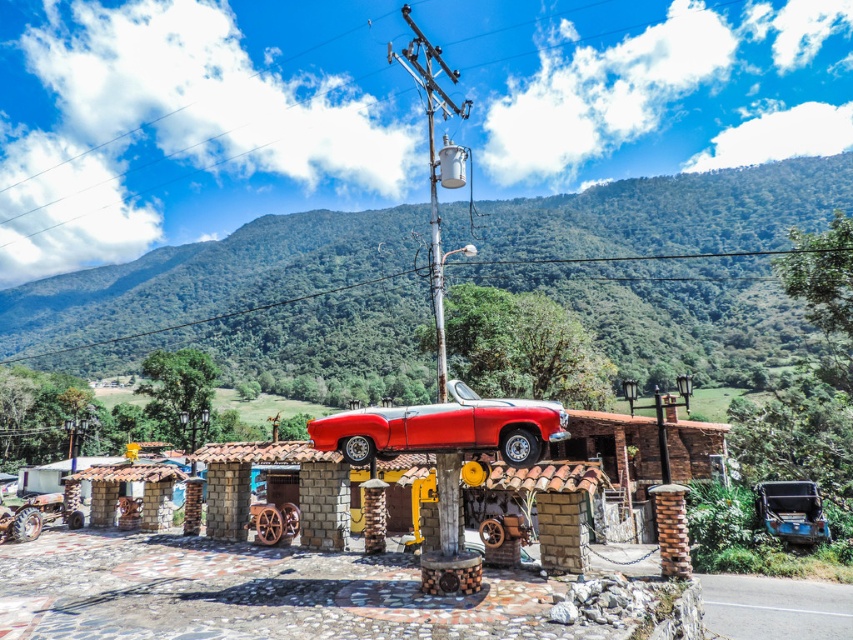
You are a delivery drone that needs to fly over both the shiny red car at center and the metallic gray transformer at upper center. Which object will require you to ascend higher to pass over?

The metallic gray transformer at upper center requires ascending higher since it is taller than the shiny red car at center.